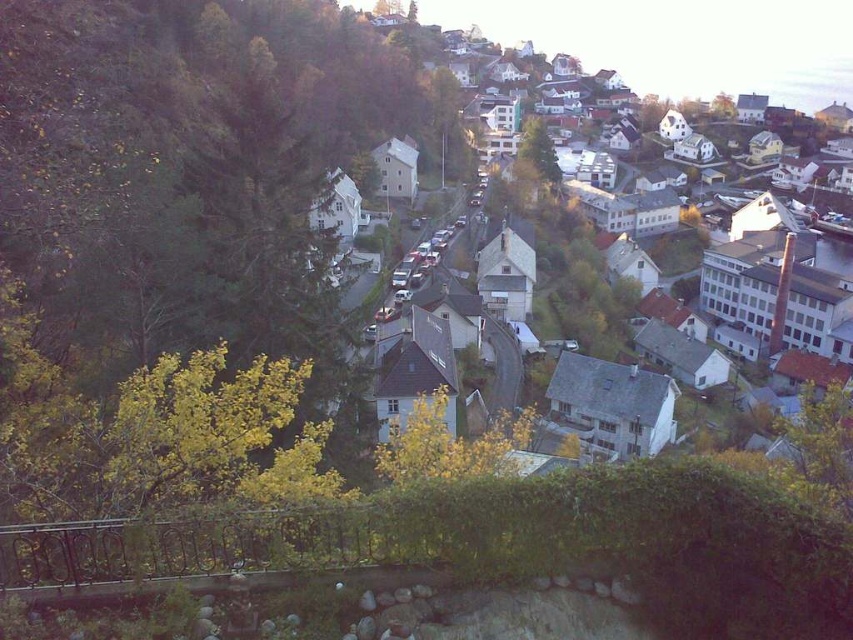
Question: Which point is closer to the camera taking this photo?

Choices:
 (A) (838, 102)
 (B) (534, 157)

Answer: (B)

Question: Among these objects, which one is farthest from the camera?

Choices:
 (A) green leafy tree at center
 (B) white matte houses at upper center

Answer: (A)

Question: Is white matte houses at upper center in front of green leafy tree at center?

Choices:
 (A) no
 (B) yes

Answer: (B)

Question: Can you confirm if white matte houses at upper center is thinner than green leafy tree at center?

Choices:
 (A) no
 (B) yes

Answer: (A)

Question: Is white matte houses at upper center smaller than green leafy tree at center?

Choices:
 (A) yes
 (B) no

Answer: (B)